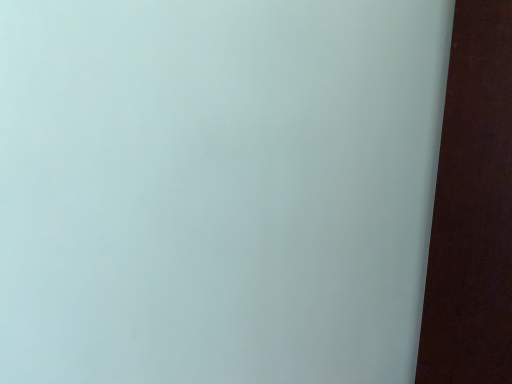
Measure the distance between matte brown plank at right and camera.

matte brown plank at right is 1.15 meters away from camera.

Locate an element on the screen. matte brown plank at right is located at coordinates (472, 208).

Describe the element at coordinates (472, 208) in the screenshot. I see `matte brown plank at right` at that location.

Image resolution: width=512 pixels, height=384 pixels. Identify the location of matte brown plank at right. (472, 208).